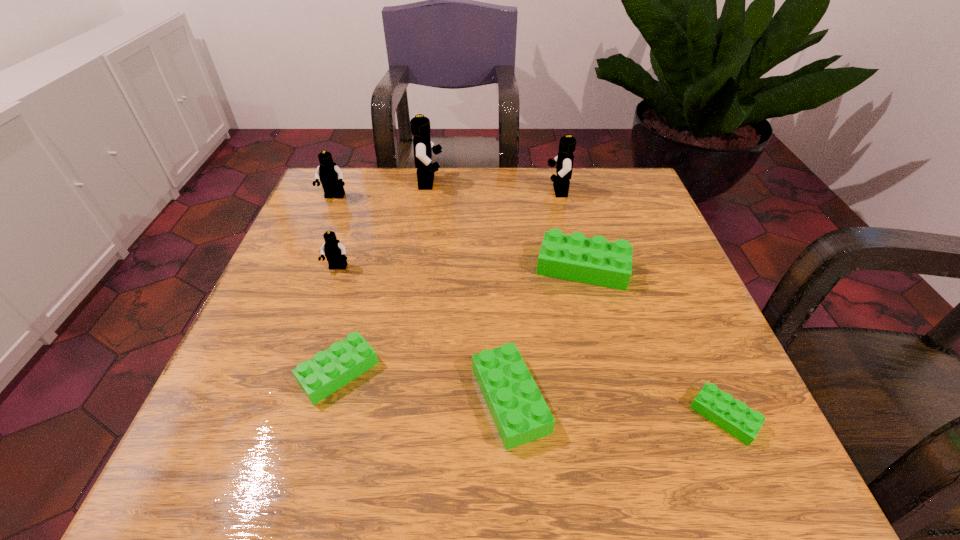
You are a GUI agent. You are given a task and a screenshot of the screen. Output one action in this format:
    pyautogui.click(x=<x>, y=<y>)
    Task: Click on the sixth tallest object
    The image size is (960, 540).
    Given the screenshot: What is the action you would take?
    pyautogui.click(x=520, y=413)

This screenshot has height=540, width=960. Identify the location of the third shortest Lego. (520, 413).

What are the coordinates of `the third biggest green Lego` in the screenshot? It's located at (329, 370).

Locate an element on the screen. This screenshot has width=960, height=540. the second shortest object is located at coordinates coord(329,370).

Where is `the shortest Lego`? the shortest Lego is located at coordinates (733, 416).

The width and height of the screenshot is (960, 540). What are the coordinates of `the smallest green Lego` in the screenshot? It's located at (733, 416).

The image size is (960, 540). I want to click on vacant point located 0.150m on the front-facing side of the tallest object, so click(x=500, y=183).

Where is `free space located 0.190m on the front-facing side of the second tallest Lego`? free space located 0.190m on the front-facing side of the second tallest Lego is located at coordinates (471, 191).

Locate an element on the screen. vacant space located on the front-facing side of the second tallest Lego is located at coordinates coord(460,191).

Identify the location of free space located 0.120m on the front-facing side of the second tallest Lego. (499, 191).